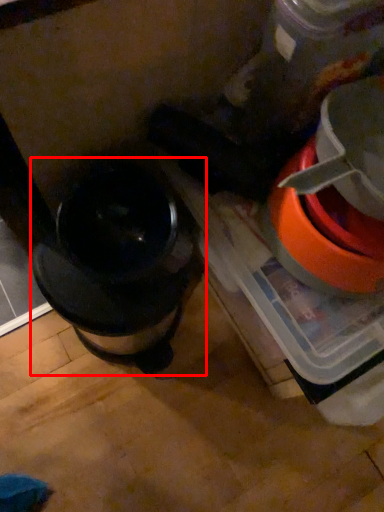
Question: From the image, what is the correct spatial relationship of kitchen appliance (annotated by the red box) in relation to appliance?

Choices:
 (A) right
 (B) left

Answer: (B)